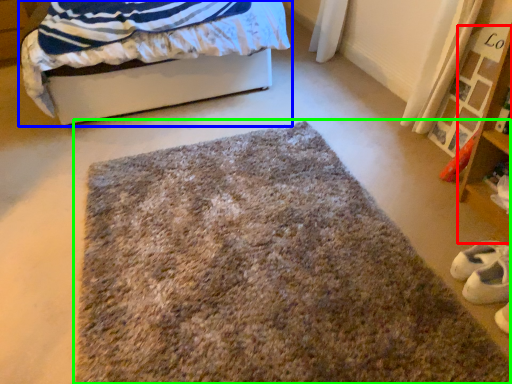
Question: Estimate the real-world distances between objects in this image. Which object is farther from shelf (highlighted by a red box), bed (highlighted by a blue box) or mat (highlighted by a green box)?

Choices:
 (A) bed
 (B) mat

Answer: (A)